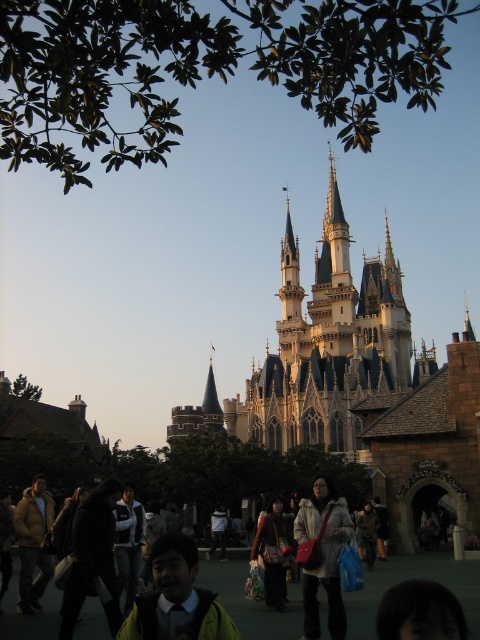
You are a theme park visitor trying to decide between two coats you found at a gift shop. The matte gray coat at center and the matte black jacket at center are both on display. Which one is bigger?

The matte gray coat at center is larger in size compared to the matte black jacket at center.

You are standing at the entrance of the theme park and see the white stone castle at center and the green matte jacket at lower center. Which object is taller?

The white stone castle at center is taller than the green matte jacket at lower center.